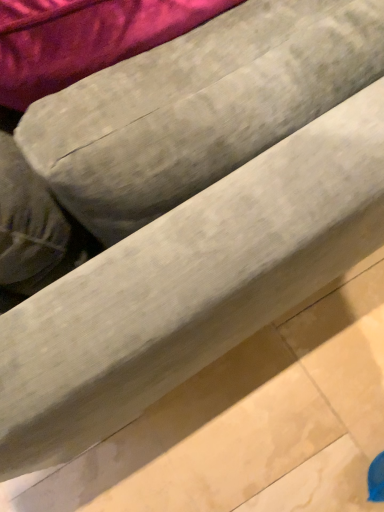
Describe the element at coordinates (202, 440) in the screenshot. I see `beige marble tile at lower right` at that location.

Where is `beige marble tile at lower right`? The width and height of the screenshot is (384, 512). beige marble tile at lower right is located at coordinates (202, 440).

What is the approximate height of textured gray bean bag at center?

83.75 centimeters.

Measure the distance between point (92, 101) and camera.

A distance of 45.40 centimeters exists between point (92, 101) and camera.

What do you see at coordinates (198, 106) in the screenshot? I see `textured gray bean bag at center` at bounding box center [198, 106].

The image size is (384, 512). Find the location of `textured gray bean bag at center`. textured gray bean bag at center is located at coordinates tap(198, 106).

Locate an element on the screen. This screenshot has width=384, height=512. beige marble tile at lower right is located at coordinates (202, 440).

Consider the image. Between beige marble tile at lower right and textured gray bean bag at center, which one appears on the left side from the viewer's perspective?

textured gray bean bag at center is more to the left.

Which object is closer to the camera, beige marble tile at lower right or textured gray bean bag at center?

textured gray bean bag at center is more forward.

Considering the positions of points (196, 381) and (126, 233), is point (196, 381) closer to camera compared to point (126, 233)?

No.

From the image's perspective, is beige marble tile at lower right positioned above or below textured gray bean bag at center?

From the image's perspective, beige marble tile at lower right appears below textured gray bean bag at center.

From a real-world perspective, who is located higher, beige marble tile at lower right or textured gray bean bag at center?

textured gray bean bag at center, from a real-world perspective.

Consider the image. Considering the relative sizes of beige marble tile at lower right and textured gray bean bag at center in the image provided, is beige marble tile at lower right thinner than textured gray bean bag at center?

No, beige marble tile at lower right is not thinner than textured gray bean bag at center.

Is beige marble tile at lower right taller or shorter than textured gray bean bag at center?

In the image, beige marble tile at lower right appears to be shorter than textured gray bean bag at center.

Is beige marble tile at lower right bigger than textured gray bean bag at center?

No, beige marble tile at lower right is not bigger than textured gray bean bag at center.

Choose the correct answer: Is beige marble tile at lower right inside textured gray bean bag at center or outside it?

beige marble tile at lower right is outside textured gray bean bag at center.

Are beige marble tile at lower right and textured gray bean bag at center located far from each other?

That's not correct — beige marble tile at lower right is a little close to textured gray bean bag at center.

Based on the photo, is textured gray bean bag at center at the back of beige marble tile at lower right?

No, beige marble tile at lower right is not facing the opposite direction of textured gray bean bag at center.

Identify the location of tile directly beneath the textured gray bean bag at center (from a real-world perspective). (202, 440).

Does textured gray bean bag at center appear on the right side of beige marble tile at lower right?

Incorrect, textured gray bean bag at center is not on the right side of beige marble tile at lower right.

Is the position of textured gray bean bag at center less distant than that of beige marble tile at lower right?

Yes, the depth of textured gray bean bag at center is less than that of beige marble tile at lower right.

Does point (123, 185) come in front of point (169, 416)?

Yes.

From the image's perspective, is textured gray bean bag at center beneath beige marble tile at lower right?

No, from the image's perspective, textured gray bean bag at center is not beneath beige marble tile at lower right.

From a real-world perspective, which object rests below the other?

beige marble tile at lower right, from a real-world perspective.

Which of these two, textured gray bean bag at center or beige marble tile at lower right, is wider?

beige marble tile at lower right is wider.

In terms of height, does textured gray bean bag at center look taller or shorter compared to beige marble tile at lower right?

textured gray bean bag at center is taller than beige marble tile at lower right.

Is textured gray bean bag at center bigger or smaller than beige marble tile at lower right?

Clearly, textured gray bean bag at center is larger in size than beige marble tile at lower right.

Would you say textured gray bean bag at center is inside or outside beige marble tile at lower right?

textured gray bean bag at center exists outside the volume of beige marble tile at lower right.

Is textured gray bean bag at center far from beige marble tile at lower right?

That's not correct — textured gray bean bag at center is a little close to beige marble tile at lower right.

Could you tell me if textured gray bean bag at center is facing beige marble tile at lower right?

No.

Can you tell me how much textured gray bean bag at center and beige marble tile at lower right differ in facing direction?

They differ by 92.4 degrees in their facing directions.

Locate an element on the screen. Image resolution: width=384 pixels, height=512 pixels. bean bag chair above the beige marble tile at lower right (from a real-world perspective) is located at coordinates (198, 106).

Where is `bean bag chair positioned vertically above the beige marble tile at lower right (from a real-world perspective)`? The width and height of the screenshot is (384, 512). bean bag chair positioned vertically above the beige marble tile at lower right (from a real-world perspective) is located at coordinates (198, 106).

I want to click on tile located below the textured gray bean bag at center (from the image's perspective), so click(x=202, y=440).